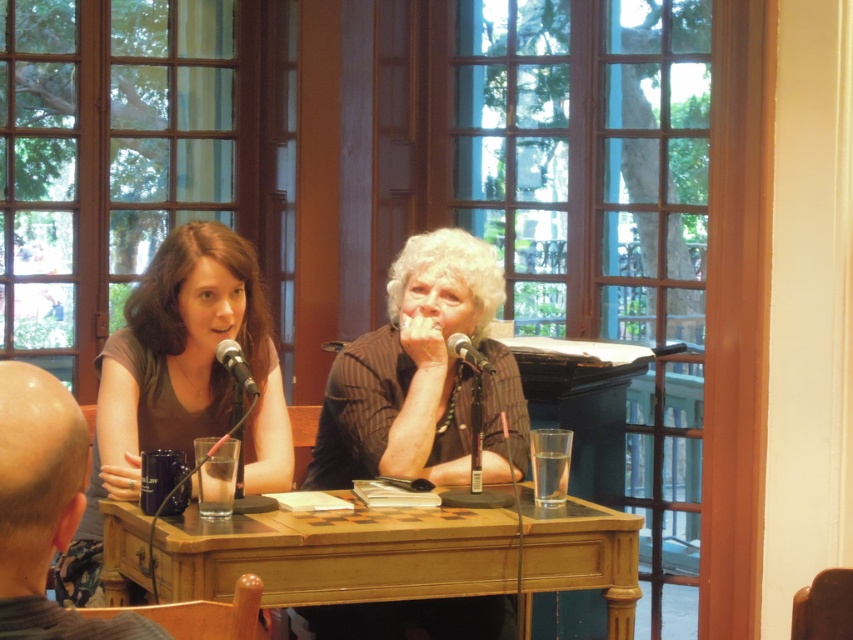
Question: Is shiny black mug at lower left to the left of metallic silver microphone at center from the viewer's perspective?

Choices:
 (A) no
 (B) yes

Answer: (B)

Question: Is striped fabric shirt at center thinner than matte black microphone at left?

Choices:
 (A) yes
 (B) no

Answer: (B)

Question: Does striped fabric shirt at center come in front of matte brown shirt at center?

Choices:
 (A) no
 (B) yes

Answer: (A)

Question: Which object is farther from the camera taking this photo?

Choices:
 (A) shiny black mug at lower left
 (B) striped fabric shirt at center

Answer: (B)

Question: Which of the following is the closest to the observer?

Choices:
 (A) shiny black mug at lower left
 (B) wooden table at center
 (C) striped fabric shirt at center

Answer: (A)

Question: Which point is farther from the camera taking this photo?

Choices:
 (A) (392, 600)
 (B) (218, 346)
 (C) (93, 525)

Answer: (C)